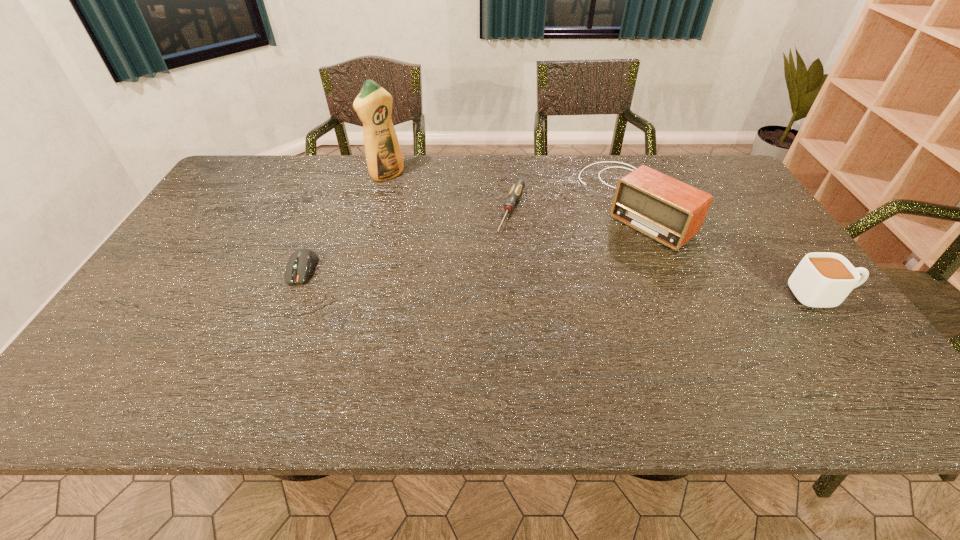
Locate an element on the screen. This screenshot has height=540, width=960. object that stands as the third closest to the cup is located at coordinates (373, 104).

This screenshot has height=540, width=960. I want to click on object that stands as the second closest to the radio receiver, so click(x=822, y=279).

At what (x,y) coordinates should I click in order to perform the action: click on free space that satisfies the following two spatial constraints: 1. on the button of the rightmost object; 2. on the side with the handle of the leftmost object. Please return your answer as a coordinate pair (x, y). The image size is (960, 540). Looking at the image, I should click on (292, 295).

This screenshot has height=540, width=960. Identify the location of free location that satisfies the following two spatial constraints: 1. on the front side of the cup; 2. on the side with the handle of the radio receiver. (671, 295).

Where is `vacant region that satisfies the following two spatial constraints: 1. on the button of the rightmost object; 2. on the side with the handle of the computer equipment`? vacant region that satisfies the following two spatial constraints: 1. on the button of the rightmost object; 2. on the side with the handle of the computer equipment is located at coordinates (292, 295).

The height and width of the screenshot is (540, 960). I want to click on vacant region that satisfies the following two spatial constraints: 1. on the front side of the second tallest object; 2. on the side with the handle of the third shortest object, so click(671, 295).

What are the coordinates of `free spot that satisfies the following two spatial constraints: 1. on the front side of the fourth shortest object; 2. on the left side of the detergent` in the screenshot? It's located at (379, 202).

At what (x,y) coordinates should I click in order to perform the action: click on vacant space that satisfies the following two spatial constraints: 1. on the front side of the rightmost object; 2. on the side with the handle of the second object from right to left. Please return your answer as a coordinate pair (x, y). This screenshot has height=540, width=960. Looking at the image, I should click on (671, 295).

Where is `vacant space that satisfies the following two spatial constraints: 1. on the front side of the fourth shortest object; 2. on the right side of the detergent`? vacant space that satisfies the following two spatial constraints: 1. on the front side of the fourth shortest object; 2. on the right side of the detergent is located at coordinates (379, 202).